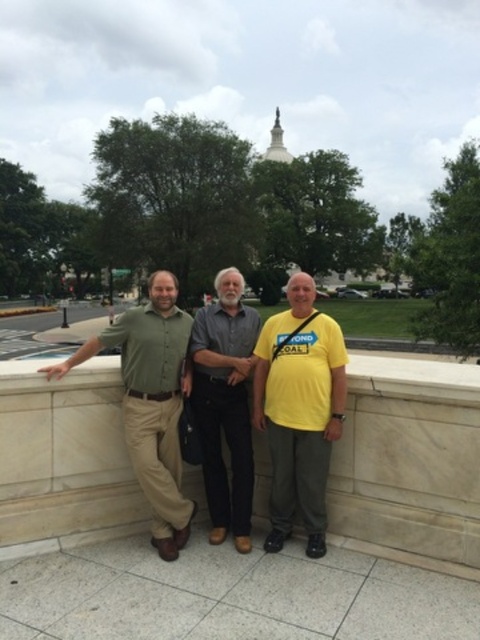
Question: Estimate the real-world distances between objects in this image. Which object is closer to the matte green shirt at center?

Choices:
 (A) green matte shirt at left
 (B) yellow matte shirt at center

Answer: (B)

Question: Based on their relative distances, which object is nearer to the matte green shirt at center?

Choices:
 (A) green matte shirt at left
 (B) white marble ledge at center
 (C) dark gray cotton shirt at center
 (D) yellow matte shirt at center

Answer: (C)

Question: Based on their relative distances, which object is nearer to the matte green shirt at center?

Choices:
 (A) yellow matte shirt at center
 (B) dark gray cotton shirt at center
 (C) green matte shirt at left
 (D) white marble ledge at center

Answer: (B)

Question: Does matte green shirt at center appear under dark gray cotton shirt at center?

Choices:
 (A) no
 (B) yes

Answer: (A)

Question: Is white marble ledge at center above matte green shirt at center?

Choices:
 (A) yes
 (B) no

Answer: (B)

Question: Is white marble ledge at center below matte green shirt at center?

Choices:
 (A) yes
 (B) no

Answer: (A)